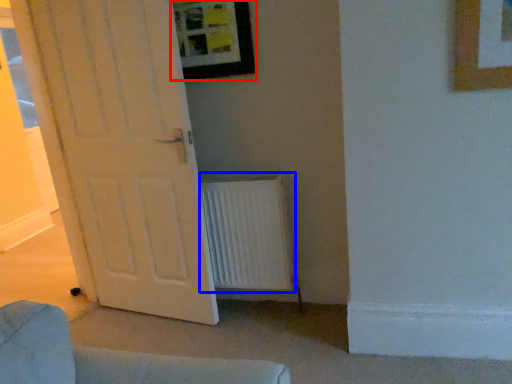
Question: Among these objects, which one is nearest to the camera, picture frame (highlighted by a red box) or radiator (highlighted by a blue box)?

Choices:
 (A) picture frame
 (B) radiator

Answer: (A)